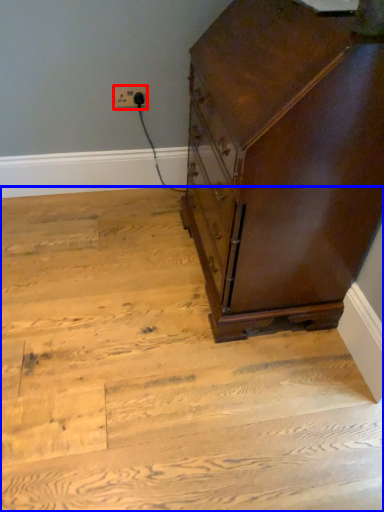
Question: Which object is further to the camera taking this photo, electric outlet (highlighted by a red box) or stairwell (highlighted by a blue box)?

Choices:
 (A) electric outlet
 (B) stairwell

Answer: (A)